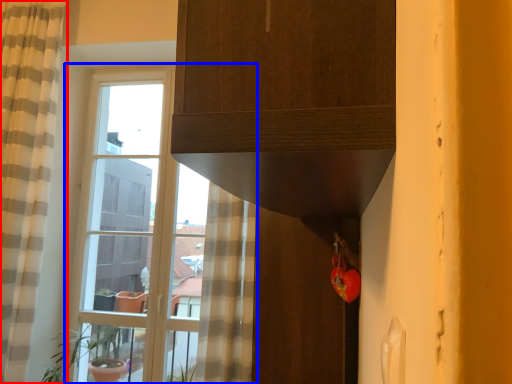
Question: Which object appears closest to the camera in this image, curtain (highlighted by a red box) or window (highlighted by a blue box)?

Choices:
 (A) curtain
 (B) window

Answer: (A)